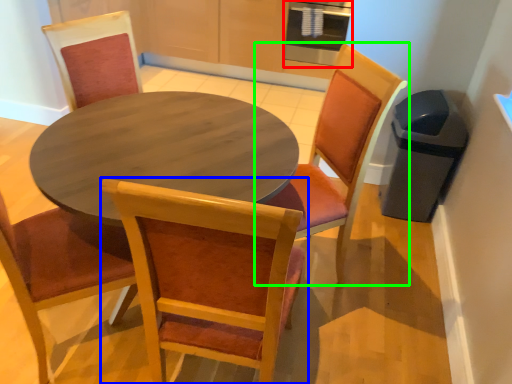
Question: Which object is positioned closest to appliance (highlighted by a red box)? Select from chair (highlighted by a blue box) and chair (highlighted by a green box).

Choices:
 (A) chair
 (B) chair

Answer: (B)